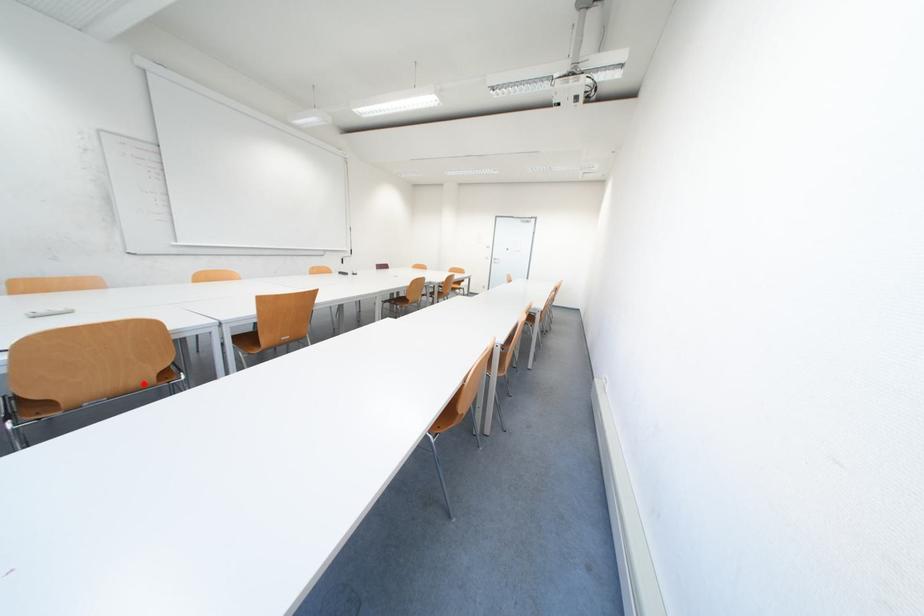
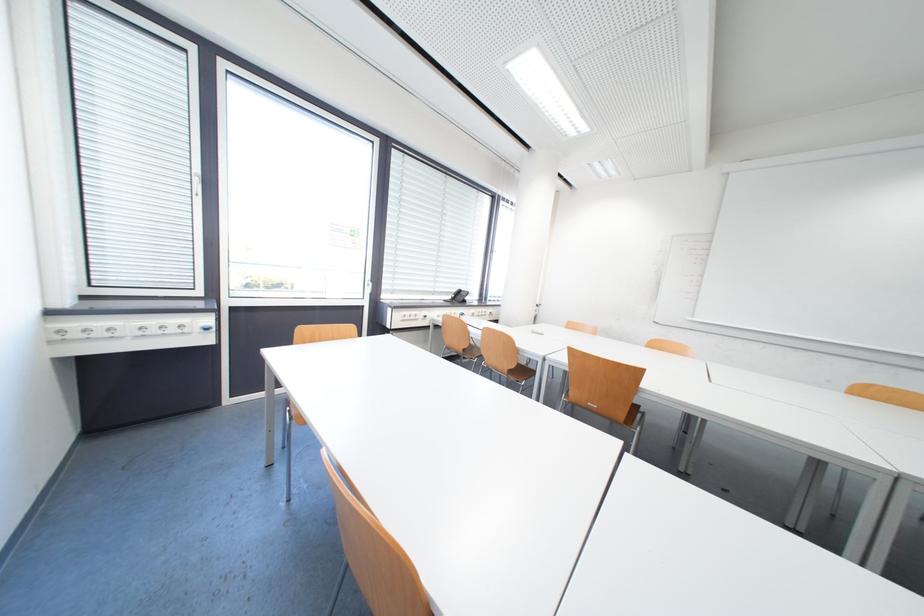
Where in the second image is the point corresponding to the highlighted location from the first image?

(511, 369)